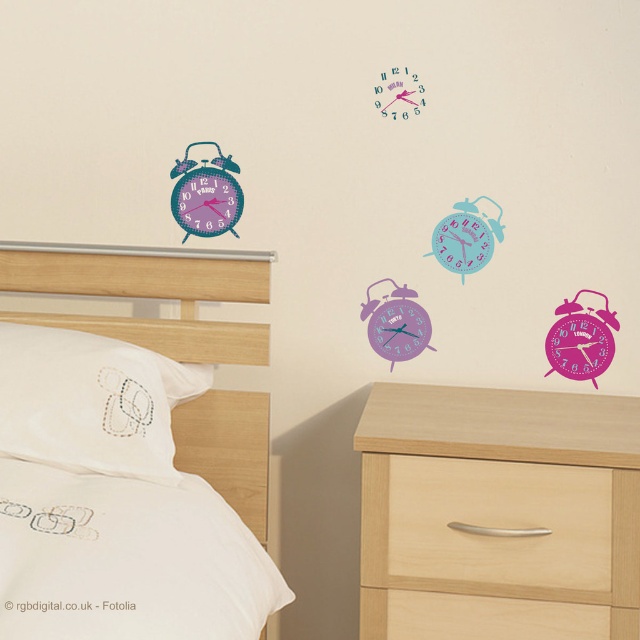
You are standing in the bedroom and want to place a new decorative item on the highest point between the white fabric bed at upper left and the purple glossy alarm clock at center. Which object should you choose to place it on?

The white fabric bed at upper left is much taller than the purple glossy alarm clock at center, so you should place the decorative item on the white fabric bed at upper left.